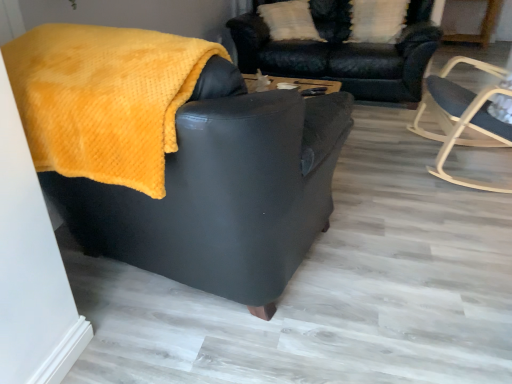
Question: Is matte black armchair at center, the 1th chair viewed from the left, to the left or to the right of white textured pillow at upper center in the image?

Choices:
 (A) right
 (B) left

Answer: (B)

Question: Is matte black armchair at center, which is counted as the second chair, starting from the right, taller or shorter than white textured pillow at upper center?

Choices:
 (A) tall
 (B) short

Answer: (A)

Question: Which object is positioned closest to the white textured pillow at upper center?

Choices:
 (A) velvet black couch at upper center
 (B) light wood rocking chair at right, acting as the 1th chair starting from the right
 (C) matte black armchair at center, the 1th chair viewed from the left

Answer: (A)

Question: Estimate the real-world distances between objects in this image. Which object is closer to the matte black armchair at center, which is counted as the second chair, starting from the right?

Choices:
 (A) velvet black couch at upper center
 (B) white textured pillow at upper center
 (C) light wood rocking chair at right, acting as the 1th chair starting from the right

Answer: (C)